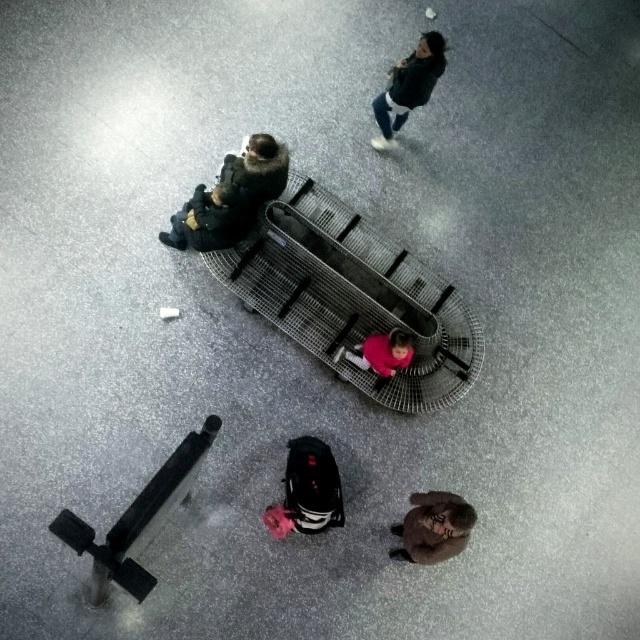
Question: Which of the following is the farthest from the observer?

Choices:
 (A) black fabric suitcase at center
 (B) dark green jacket at upper center
 (C) brown fuzzy coat at lower right

Answer: (B)

Question: Which point is farther to the camera?

Choices:
 (A) black fabric suitcase at center
 (B) brown fuzzy coat at lower right
 (C) dark green jacket at upper center

Answer: (C)

Question: Is dark gray fabric jacket at upper left to the right of black fabric suitcase at center from the viewer's perspective?

Choices:
 (A) no
 (B) yes

Answer: (A)

Question: Does dark gray fabric jacket at upper left appear on the left side of brown fuzzy coat at lower right?

Choices:
 (A) no
 (B) yes

Answer: (B)

Question: Which is farther from the dark green jacket at upper center?

Choices:
 (A) brown fuzzy coat at lower right
 (B) dark gray fabric jacket at upper left

Answer: (A)

Question: From the image, what is the correct spatial relationship of black fabric suitcase at center in relation to brown fuzzy coat at lower right?

Choices:
 (A) left
 (B) right

Answer: (A)